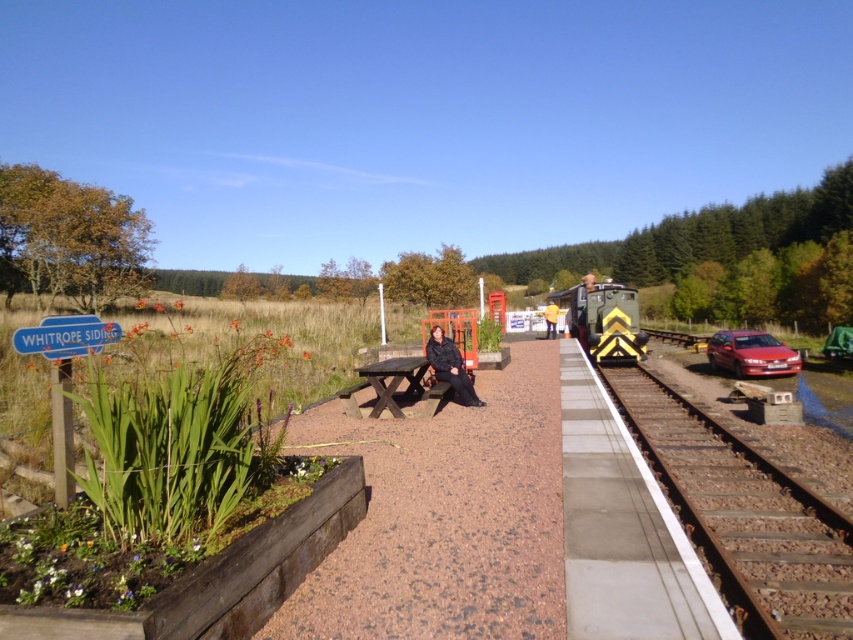
Question: Which of the following is the farthest from the observer?

Choices:
 (A) black fabric jacket at center
 (B) rusty metal train track at right

Answer: (A)

Question: Is rusty metal train track at right behind matte red car at right?

Choices:
 (A) yes
 (B) no

Answer: (B)

Question: Can you confirm if rusty metal train track at right is positioned to the left of dark blue jacket at center?

Choices:
 (A) yes
 (B) no

Answer: (A)

Question: Does green painted metal train at center have a smaller size compared to dark blue jacket at center?

Choices:
 (A) yes
 (B) no

Answer: (A)

Question: Considering the real-world distances, which object is farthest from the black fabric jacket at center?

Choices:
 (A) green painted metal train at center
 (B) brown wooden picnic table at center
 (C) rusty metal train track at right
 (D) dark blue jacket at center

Answer: (D)

Question: Estimate the real-world distances between objects in this image. Which object is farther from the dark blue jacket at center?

Choices:
 (A) black fabric jacket at center
 (B) brown wooden picnic table at center
 (C) matte red car at right

Answer: (B)